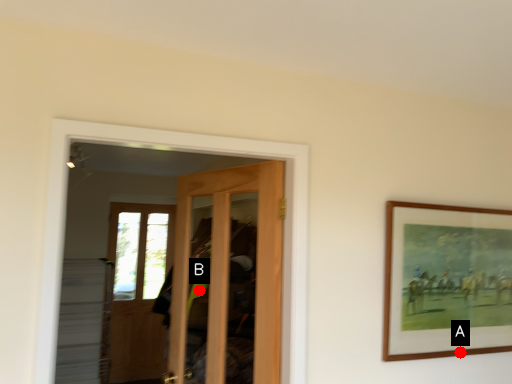
Question: Two points are circled on the image, labeled by A and B beside each circle. Which point is closer to the camera?

Choices:
 (A) A is closer
 (B) B is closer

Answer: (A)